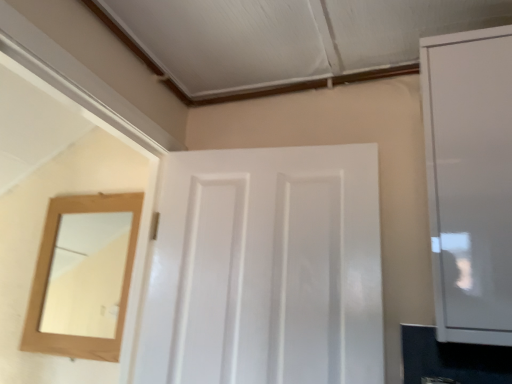
The image size is (512, 384). What do you see at coordinates (266, 268) in the screenshot?
I see `white glossy door at center` at bounding box center [266, 268].

Locate an element on the screen. The image size is (512, 384). white glossy door at center is located at coordinates (266, 268).

Describe the element at coordinates (470, 181) in the screenshot. This screenshot has height=384, width=512. I see `white glossy cabinet at right` at that location.

You are a GUI agent. You are given a task and a screenshot of the screen. Output one action in this format:
    pyautogui.click(x=<x>, y=<y>)
    Task: Click on the white glossy cabinet at right
    
    Given the screenshot: What is the action you would take?
    pyautogui.click(x=470, y=181)

Where is `white glossy door at center`? This screenshot has width=512, height=384. white glossy door at center is located at coordinates point(266,268).

Considering the relative positions of white glossy cabinet at right and white glossy door at center in the image provided, is white glossy cabinet at right to the right of white glossy door at center from the viewer's perspective?

Yes, white glossy cabinet at right is to the right of white glossy door at center.

Which object is further away from the camera taking this photo, white glossy cabinet at right or white glossy door at center?

white glossy door at center.

Which is less distant, (460,316) or (141,358)?

Point (460,316) appears to be closer to the viewer than point (141,358).

From the image's perspective, which one is positioned higher, white glossy cabinet at right or white glossy door at center?

white glossy cabinet at right is shown above in the image.

From a real-world perspective, relative to white glossy door at center, is white glossy cabinet at right vertically above or below?

From a real-world perspective, white glossy cabinet at right is physically above white glossy door at center.

Which of these two, white glossy cabinet at right or white glossy door at center, is thinner?

Thinner between the two is white glossy cabinet at right.

Does white glossy cabinet at right have a lesser height compared to white glossy door at center?

In fact, white glossy cabinet at right may be taller than white glossy door at center.

Considering the sizes of white glossy cabinet at right and white glossy door at center in the image, is white glossy cabinet at right bigger or smaller than white glossy door at center?

In the image, white glossy cabinet at right appears to be smaller than white glossy door at center.

Is white glossy cabinet at right situated inside white glossy door at center or outside?

white glossy cabinet at right is spatially situated outside white glossy door at center.

Does white glossy cabinet at right touch white glossy door at center?

No, white glossy cabinet at right is not making contact with white glossy door at center.

Is white glossy cabinet at right aimed at white glossy door at center?

No, white glossy cabinet at right is not facing towards white glossy door at center.

What's the angular difference between white glossy cabinet at right and white glossy door at center's facing directions?

4.51 degrees separate the facing orientations of white glossy cabinet at right and white glossy door at center.

Locate an element on the screen. This screenshot has width=512, height=384. door located behind the white glossy cabinet at right is located at coordinates (266, 268).

Which object is positioned more to the right, white glossy door at center or white glossy cabinet at right?

Positioned to the right is white glossy cabinet at right.

Is white glossy door at center further to camera compared to white glossy cabinet at right?

Yes, it is behind white glossy cabinet at right.

Which is behind, point (165, 355) or point (479, 152)?

Point (165, 355)

From the image's perspective, is white glossy door at center located beneath white glossy cabinet at right?

Yes, from the image's perspective, white glossy door at center is beneath white glossy cabinet at right.

From a real-world perspective, who is located lower, white glossy door at center or white glossy cabinet at right?

white glossy door at center is physically lower.

Which of these two, white glossy door at center or white glossy cabinet at right, is wider?

With larger width is white glossy door at center.

From their relative heights in the image, would you say white glossy door at center is taller or shorter than white glossy cabinet at right?

Clearly, white glossy door at center is shorter compared to white glossy cabinet at right.

Considering the relative sizes of white glossy door at center and white glossy cabinet at right in the image provided, is white glossy door at center smaller than white glossy cabinet at right?

Incorrect, white glossy door at center is not smaller in size than white glossy cabinet at right.

Could white glossy cabinet at right be considered to be inside white glossy door at center?

No, white glossy cabinet at right is not inside white glossy door at center.

Is white glossy door at center next to white glossy cabinet at right and touching it?

No, white glossy door at center is not with white glossy cabinet at right.

Could you tell me if white glossy door at center is turned towards white glossy cabinet at right?

No, white glossy door at center is not oriented towards white glossy cabinet at right.

This screenshot has height=384, width=512. Find the location of `cabinetry that is in front of the white glossy door at center`. cabinetry that is in front of the white glossy door at center is located at coordinates (470, 181).

In the image, there is a white glossy cabinet at right. Identify the location of door below it (from a real-world perspective). (266, 268).

At what (x,y) coordinates should I click in order to perform the action: click on cabinetry positioned vertically above the white glossy door at center (from a real-world perspective). Please return your answer as a coordinate pair (x, y). This screenshot has height=384, width=512. Looking at the image, I should click on (470, 181).